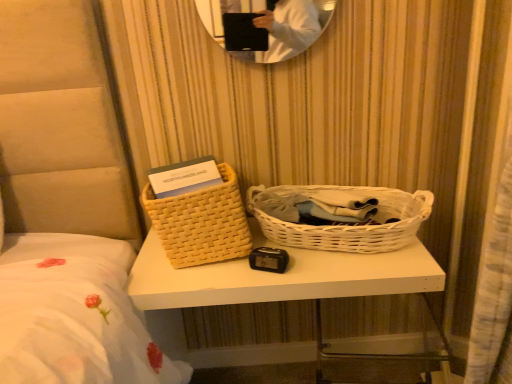
Question: Can you confirm if woven beige basket at left, which appears as the second picnic basket when viewed from the right, is thinner than white wicker picnic basket at center, which is counted as the 1th picnic basket, starting from the right?

Choices:
 (A) yes
 (B) no

Answer: (A)

Question: Considering the relative sizes of woven beige basket at left, which appears as the second picnic basket when viewed from the right, and white wicker picnic basket at center, placed as the second picnic basket when sorted from left to right, in the image provided, is woven beige basket at left, which appears as the second picnic basket when viewed from the right, wider than white wicker picnic basket at center, placed as the second picnic basket when sorted from left to right,?

Choices:
 (A) no
 (B) yes

Answer: (A)

Question: Is the depth of woven beige basket at left, which appears as the second picnic basket when viewed from the right, less than that of white wicker picnic basket at center, which is counted as the 1th picnic basket, starting from the right?

Choices:
 (A) yes
 (B) no

Answer: (B)

Question: Is the position of woven beige basket at left, which appears as the 1th picnic basket when viewed from the left, more distant than that of white wicker picnic basket at center, placed as the second picnic basket when sorted from left to right?

Choices:
 (A) no
 (B) yes

Answer: (B)

Question: Does woven beige basket at left, which appears as the 1th picnic basket when viewed from the left, have a smaller size compared to white wicker picnic basket at center, which is counted as the 1th picnic basket, starting from the right?

Choices:
 (A) yes
 (B) no

Answer: (A)

Question: Is woven beige basket at left, which appears as the second picnic basket when viewed from the right, touching white wicker picnic basket at center, placed as the second picnic basket when sorted from left to right?

Choices:
 (A) no
 (B) yes

Answer: (A)

Question: Is white woven basket at center in front of woven beige basket at left, which appears as the 1th picnic basket when viewed from the left?

Choices:
 (A) yes
 (B) no

Answer: (A)

Question: Is white woven basket at center turned away from woven beige basket at left, which appears as the 1th picnic basket when viewed from the left?

Choices:
 (A) no
 (B) yes

Answer: (A)

Question: Is white woven basket at center at the left side of woven beige basket at left, which appears as the 1th picnic basket when viewed from the left?

Choices:
 (A) yes
 (B) no

Answer: (B)

Question: Does white woven basket at center come behind woven beige basket at left, which appears as the second picnic basket when viewed from the right?

Choices:
 (A) yes
 (B) no

Answer: (B)

Question: Considering the relative sizes of white woven basket at center and woven beige basket at left, which appears as the second picnic basket when viewed from the right, in the image provided, is white woven basket at center shorter than woven beige basket at left, which appears as the second picnic basket when viewed from the right,?

Choices:
 (A) yes
 (B) no

Answer: (B)

Question: Is woven beige basket at left, which appears as the 1th picnic basket when viewed from the left, located within white woven basket at center?

Choices:
 (A) yes
 (B) no

Answer: (B)

Question: From a real-world perspective, is white wicker picnic basket at center, which is counted as the 1th picnic basket, starting from the right, beneath woven beige basket at left, which appears as the second picnic basket when viewed from the right?

Choices:
 (A) yes
 (B) no

Answer: (A)